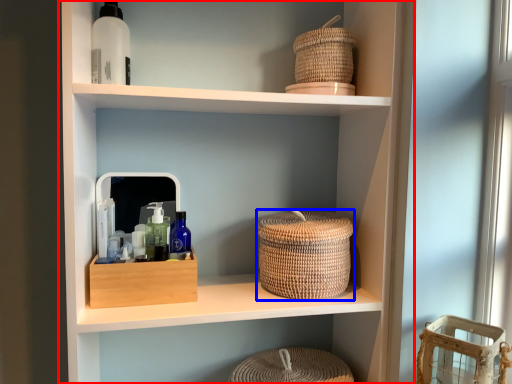
Question: Among these objects, which one is nearest to the camera, shelf (highlighted by a red box) or basket (highlighted by a blue box)?

Choices:
 (A) shelf
 (B) basket

Answer: (A)